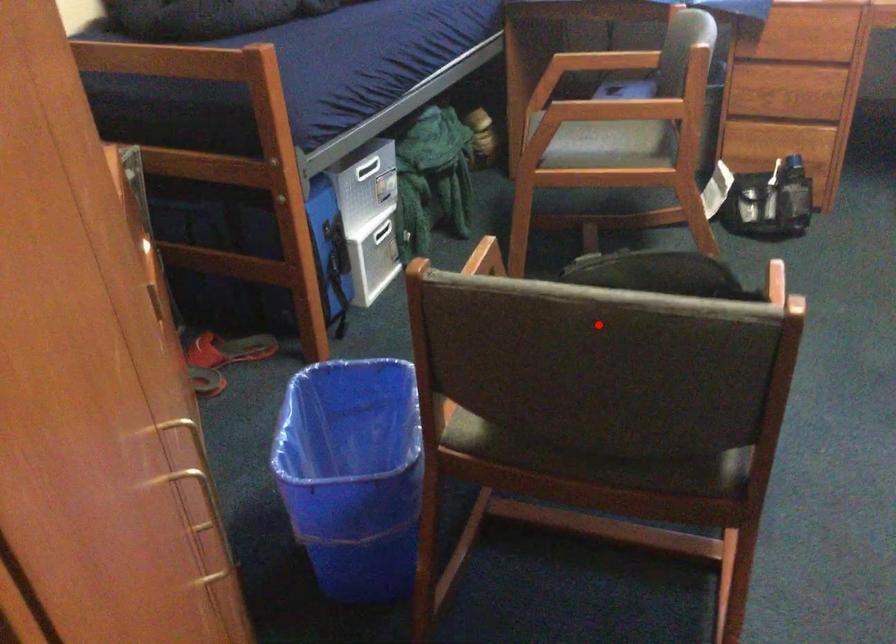
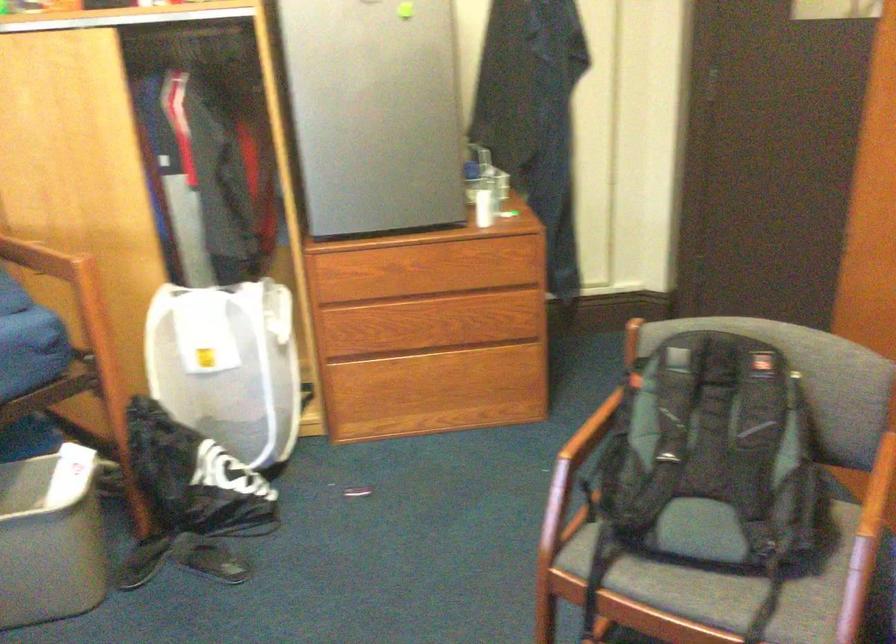
Where in the second image is the point corresponding to the highlighted location from the first image?

(717, 456)